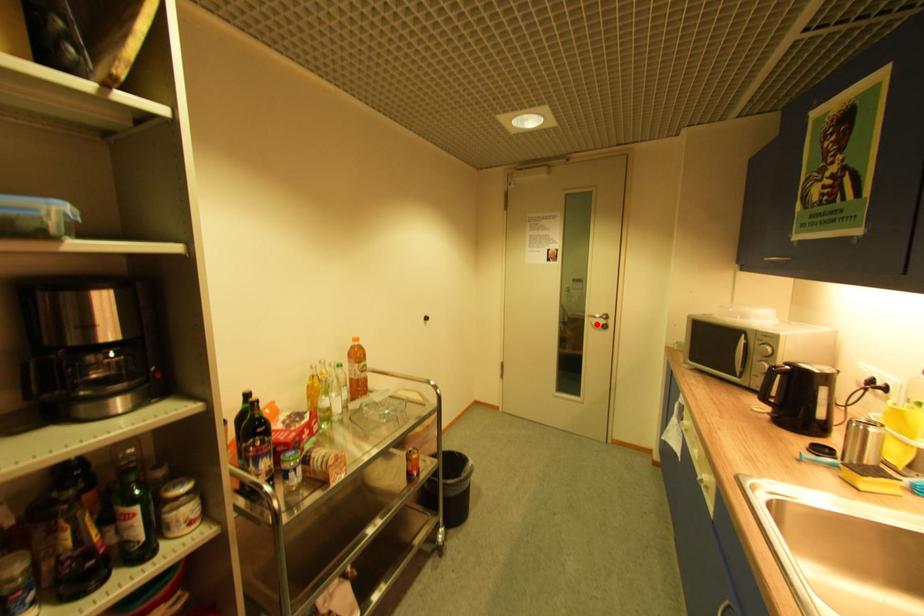
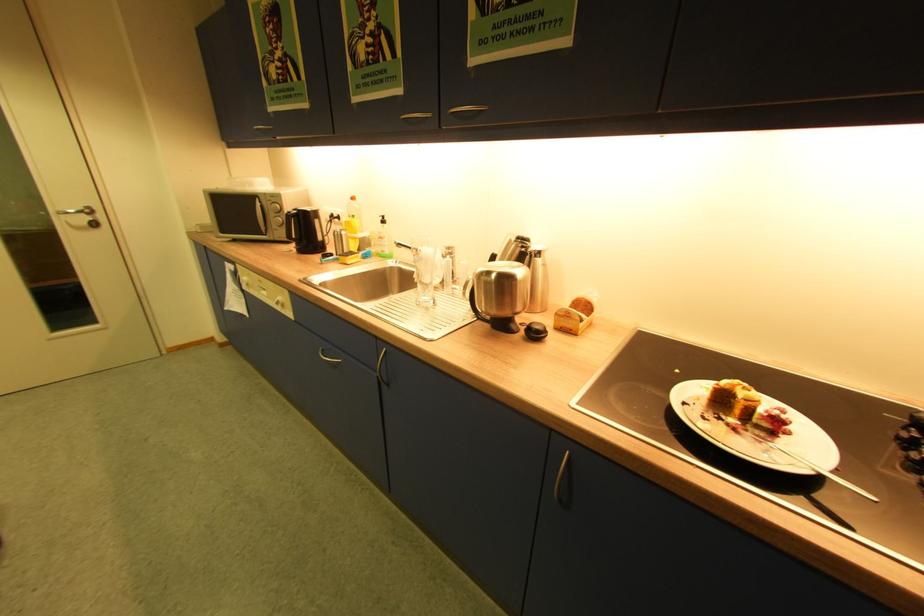
Question: I am providing you with two images of the same scene from different viewpoints. Given a red point in image1, look at the same physical point in image2. Is it:

Choices:
 (A) Closer to the viewpoint
 (B) Farther from the viewpoint

Answer: (B)